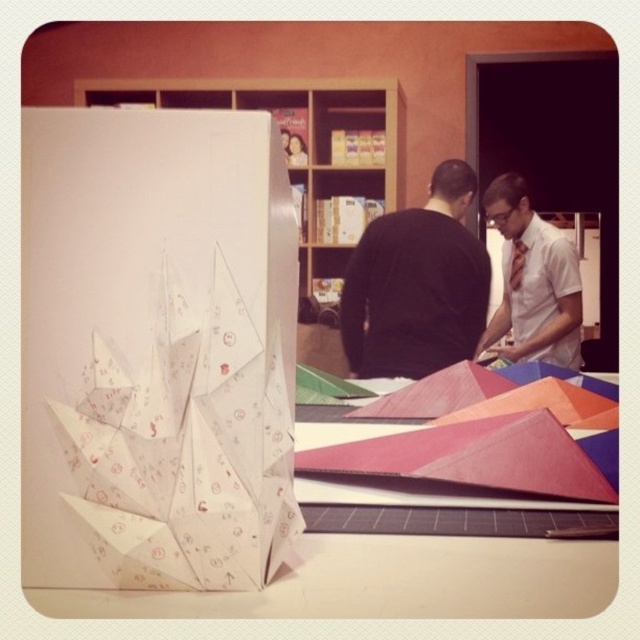
Question: Among these objects, which one is nearest to the camera?

Choices:
 (A) white cardboard at upper center
 (B) matte white shirt at center
 (C) black matte shirt at center

Answer: (C)

Question: Is black matte shirt at center thinner than matte white shirt at center?

Choices:
 (A) yes
 (B) no

Answer: (B)

Question: Can you confirm if white paper table at center is bigger than black matte shirt at center?

Choices:
 (A) yes
 (B) no

Answer: (B)

Question: Which object is closer to the camera taking this photo?

Choices:
 (A) black matte shirt at center
 (B) white paper table at center
 (C) matte white shirt at center

Answer: (B)

Question: Does white paper table at center lie behind matte white shirt at center?

Choices:
 (A) yes
 (B) no

Answer: (B)

Question: Which object is the closest to the white paper table at center?

Choices:
 (A) white cardboard at upper center
 (B) matte white shirt at center

Answer: (B)